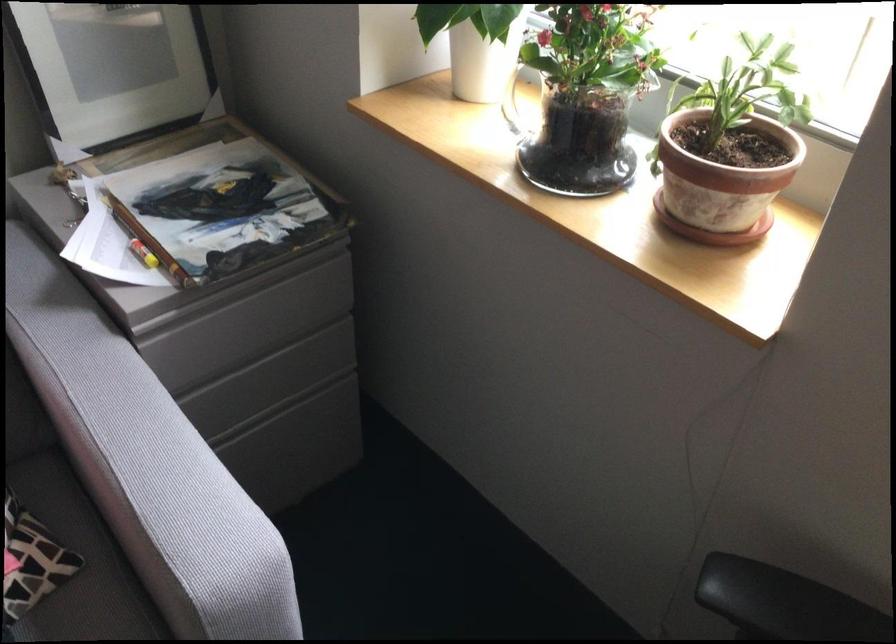
Find where to grasp the glass pitcher handle. Please return your answer as a coordinate pair (x, y).

(519, 109)